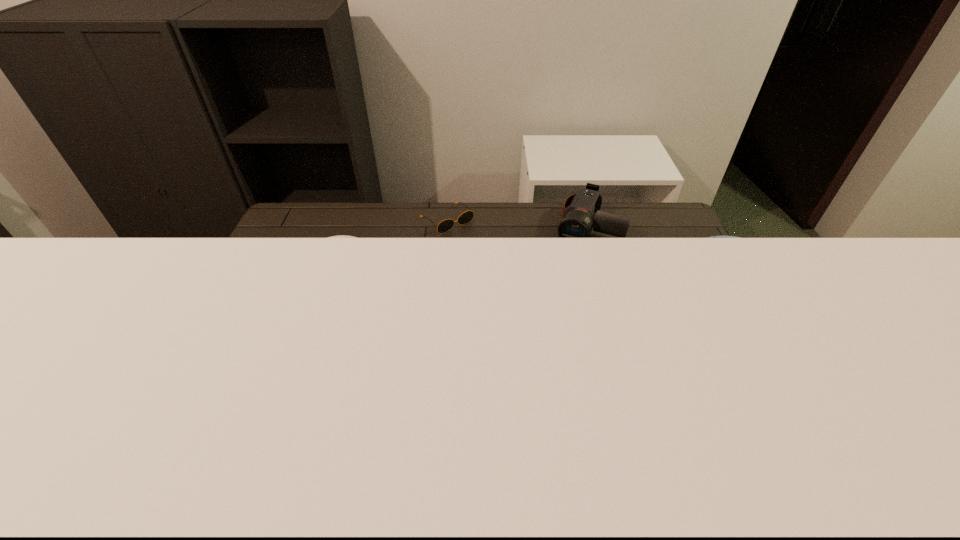
You are a GUI agent. You are given a task and a screenshot of the screen. Output one action in this format:
    pyautogui.click(x=<x>, y=<y>)
    Task: Click on the vacant space on the desktop that is between the left soccer ball and the right soccer ball and is positioned on the lens of the camcorder
    The image size is (960, 540).
    Given the screenshot: What is the action you would take?
    pyautogui.click(x=540, y=321)

This screenshot has height=540, width=960. In order to click on vacant spot on the desktop that is between the left soccer ball and the right soccer ball and is positioned on the front-facing side of the shortest object in this screenshot , I will do `click(555, 321)`.